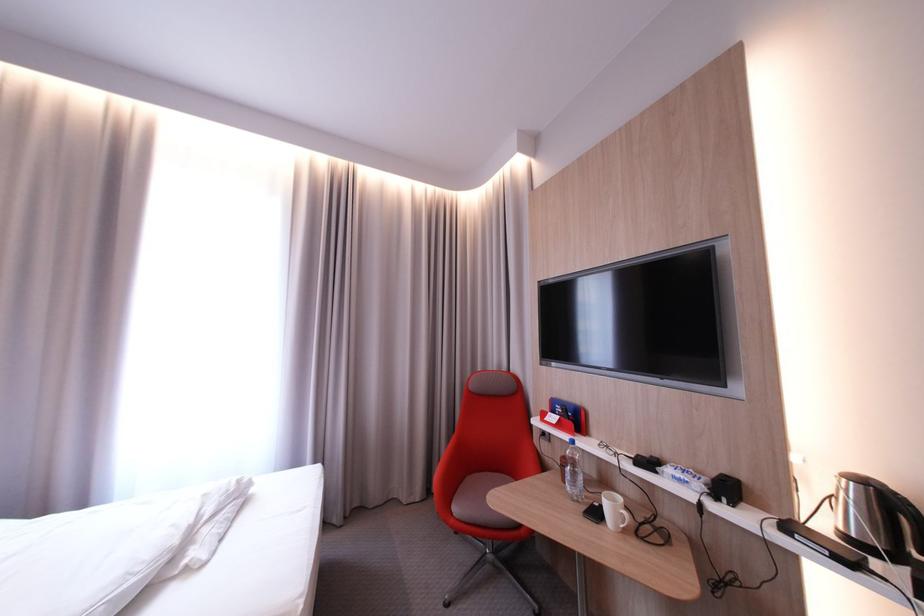
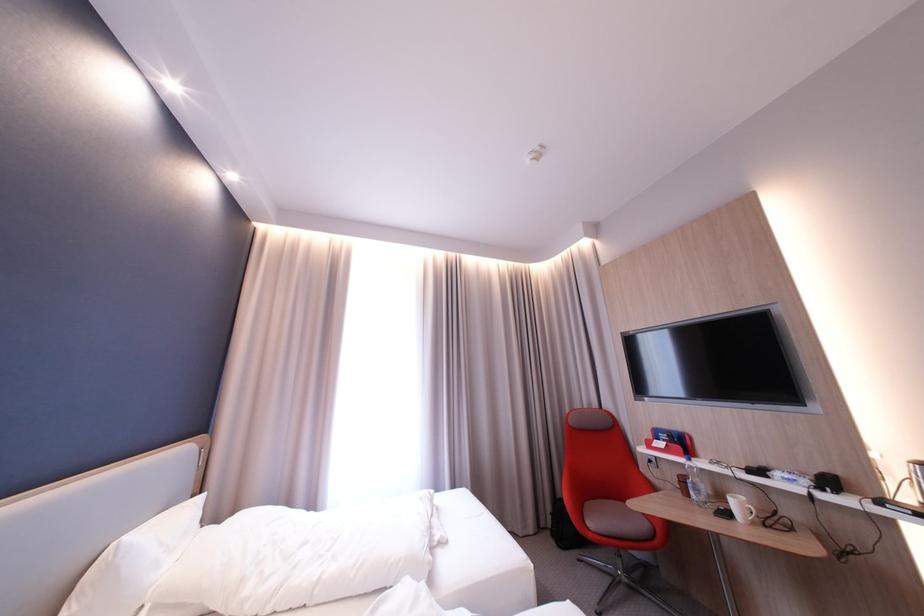
Where in the second image is the point corresponding to [464,514] from the first image?

(600, 529)